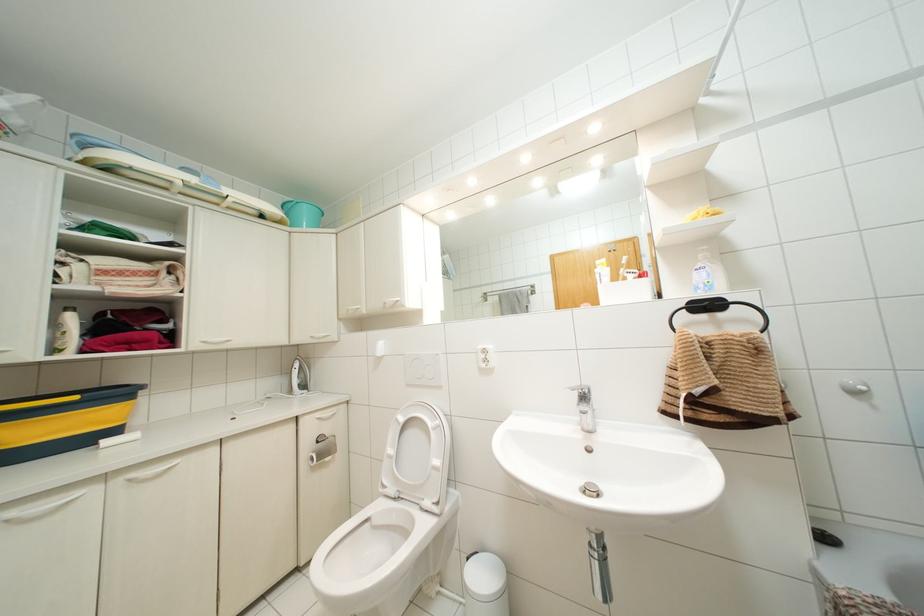
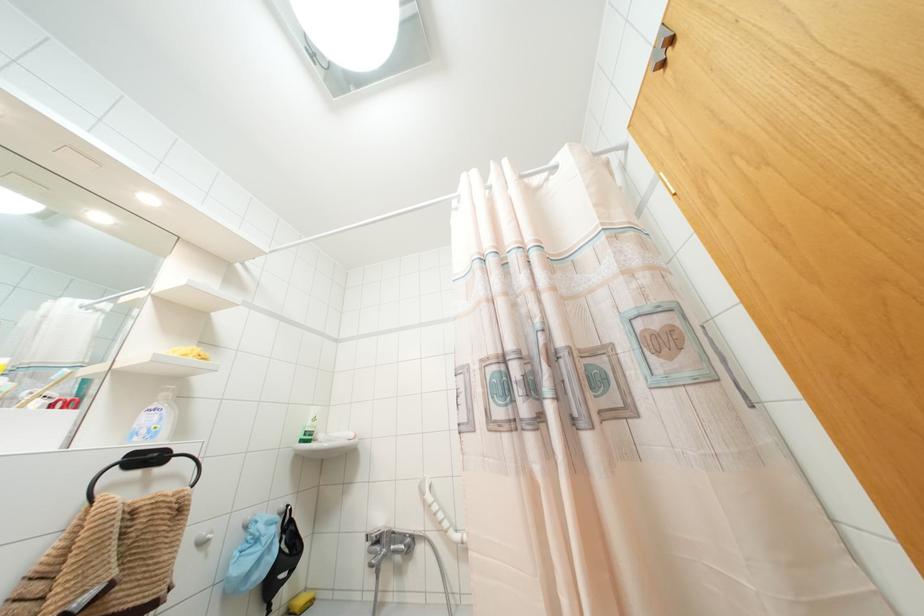
Locate, in the second image, the point that corresponds to point 703,274 in the first image.

(154, 418)